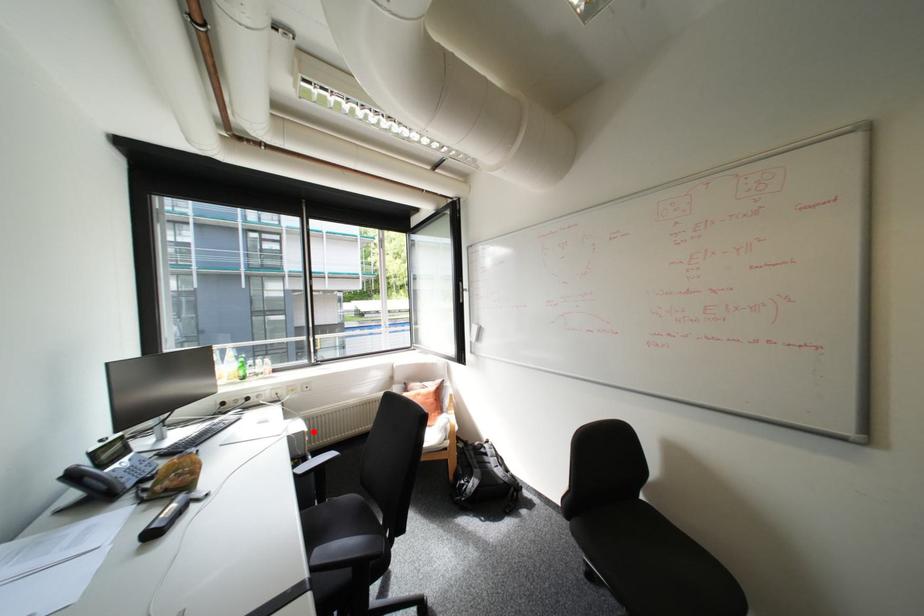
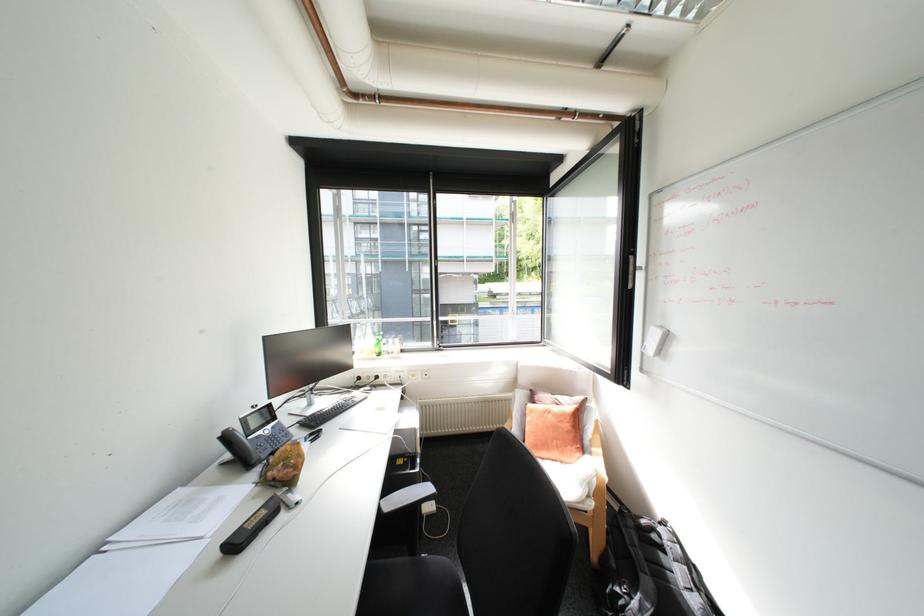
Find the pixel in the second image that matches the highlighted location in the first image.

(424, 429)